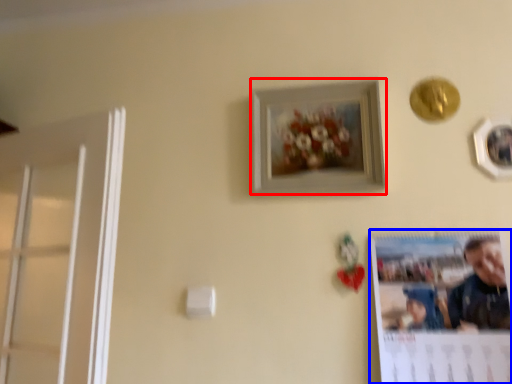
Question: Which object is closer to the camera taking this photo, picture frame (highlighted by a red box) or poster page (highlighted by a blue box)?

Choices:
 (A) picture frame
 (B) poster page

Answer: (B)